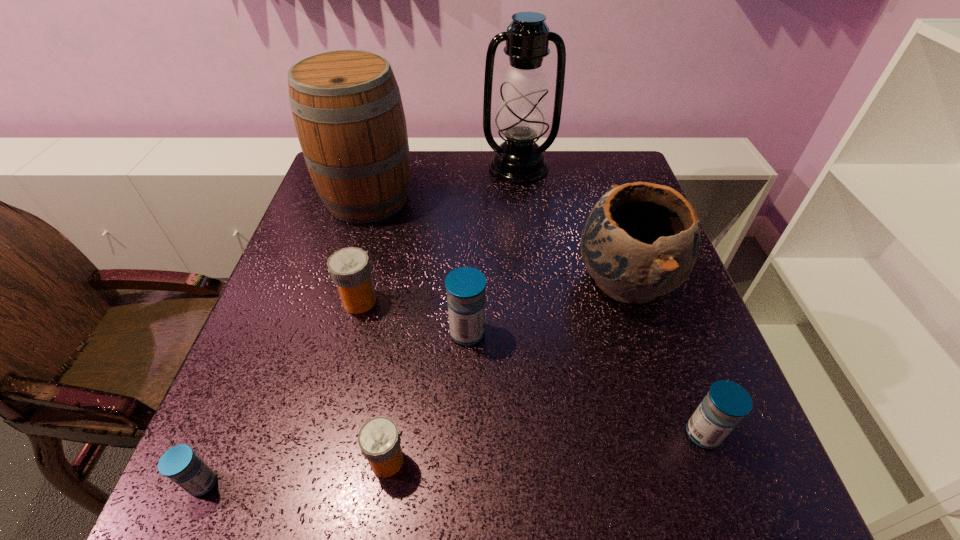
Find the location of `free location located on the label side of the smaller orange medicine`. free location located on the label side of the smaller orange medicine is located at coordinates (530, 461).

Identify the location of vacant area situated on the back of the leftmost blue medicine. point(282,295).

In order to click on oil lamp situated at the far edge in this screenshot , I will do `click(522, 116)`.

You are a GUI agent. You are given a task and a screenshot of the screen. Output one action in this format:
    pyautogui.click(x=<x>, y=<y>)
    Task: Click on the cider that is at the far edge
    
    Given the screenshot: What is the action you would take?
    pyautogui.click(x=348, y=113)

Find the location of `cider that is at the left edge`. cider that is at the left edge is located at coordinates (348, 113).

Where is `pottery at the right edge`? This screenshot has width=960, height=540. pottery at the right edge is located at coordinates (641, 240).

At what (x,y) coordinates should I click in order to perform the action: click on medicine that is at the right edge. Please return your answer as a coordinate pair (x, y). Looking at the image, I should click on (726, 403).

Locate an element on the screen. The image size is (960, 540). object present at the far left corner is located at coordinates (348, 113).

Where is `object that is at the near left corner`? object that is at the near left corner is located at coordinates (180, 464).

Locate an element on the screen. This screenshot has width=960, height=540. free space at the far edge of the desktop is located at coordinates (445, 172).